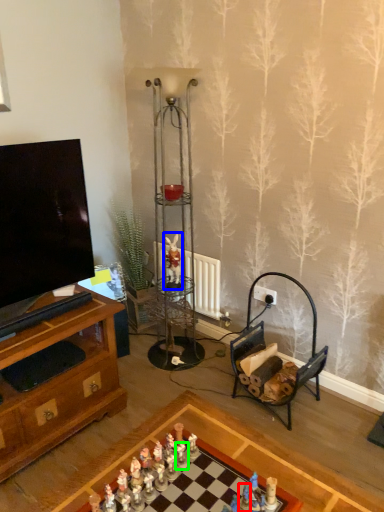
Question: Considering the real-world distances, which object is farthest from toy (highlighted by a red box)? miniature (highlighted by a blue box) or toy (highlighted by a green box)?

Choices:
 (A) miniature
 (B) toy

Answer: (A)